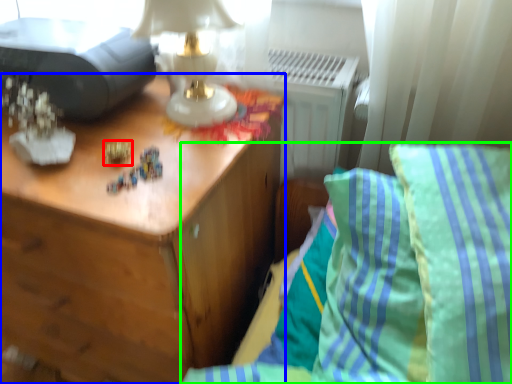
Question: Estimate the real-world distances between objects in this image. Which object is farther from toy (highlighted by a red box), nightstand (highlighted by a blue box) or furniture (highlighted by a green box)?

Choices:
 (A) nightstand
 (B) furniture

Answer: (B)